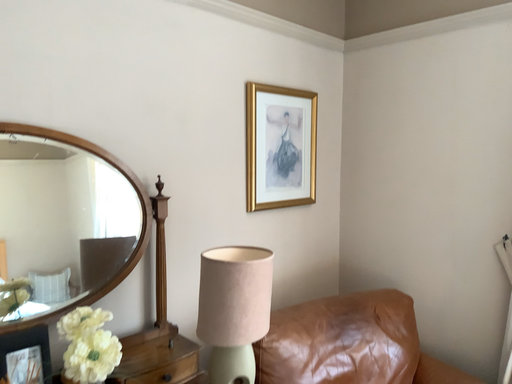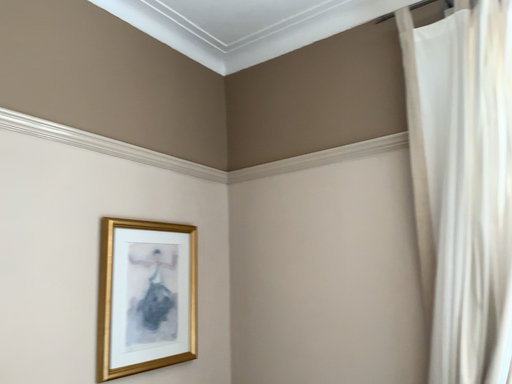
Question: Which way did the camera rotate in the video?

Choices:
 (A) rotated right
 (B) rotated left

Answer: (A)